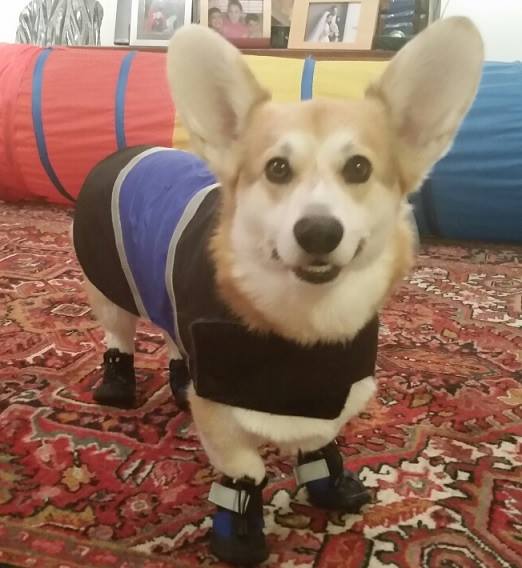
Where is `rug`? rug is located at coordinates (140, 444).